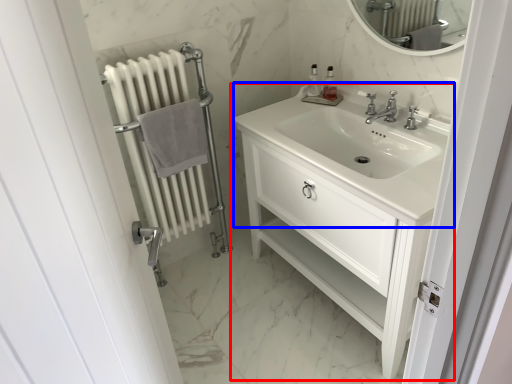
Question: Which object is further to the camera taking this photo, bathroom cabinet (highlighted by a red box) or sink (highlighted by a blue box)?

Choices:
 (A) bathroom cabinet
 (B) sink

Answer: (B)